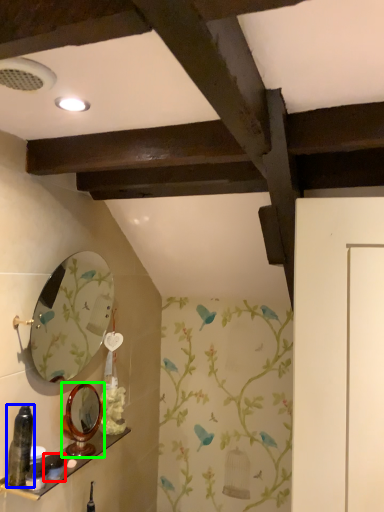
Question: Estimate the real-world distances between objects in this image. Which object is farther from toiletry (highlighted by a red box), bottle (highlighted by a blue box) or mirror (highlighted by a green box)?

Choices:
 (A) bottle
 (B) mirror

Answer: (A)